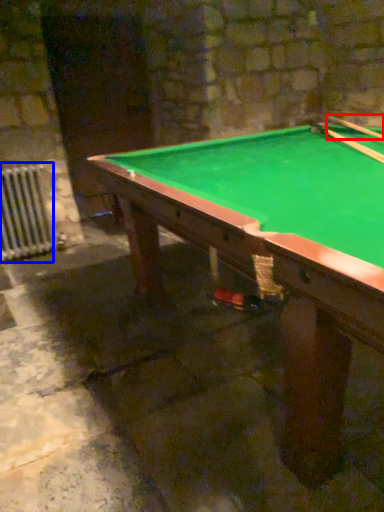
Question: Which of the following is the closest to the observer, cue (highlighted by a red box) or radiator (highlighted by a blue box)?

Choices:
 (A) cue
 (B) radiator

Answer: (A)